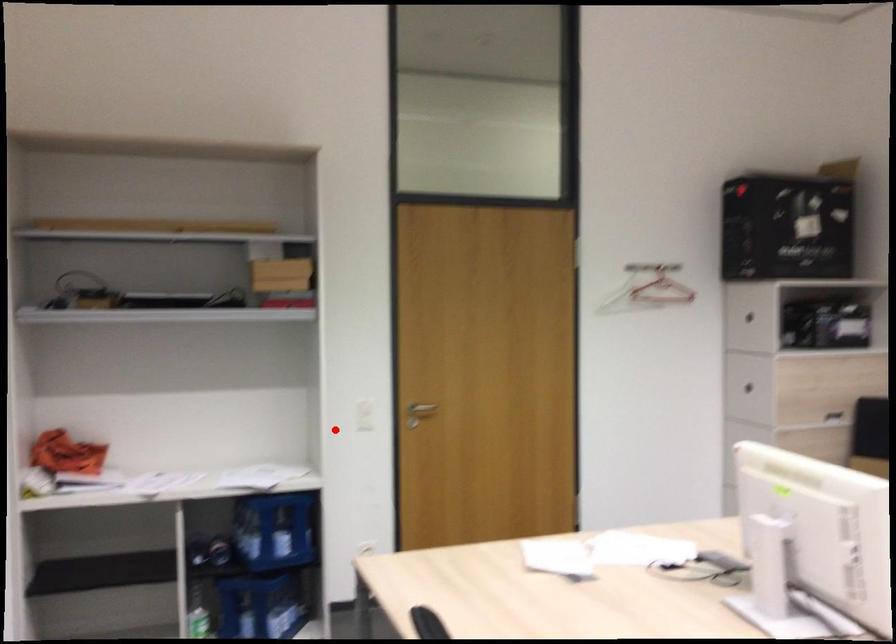
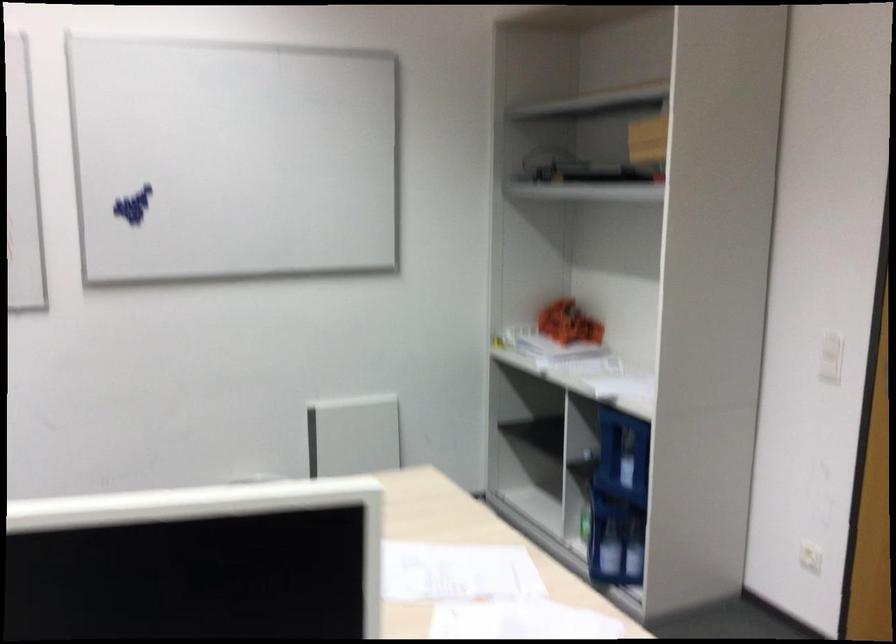
Question: A red point is marked in image1. In image2, is the corresponding 3D point closer to the camera or farther? Reply with the corresponding letter.

Choices:
 (A) The corresponding 3D point is closer.
 (B) The corresponding 3D point is farther.

Answer: (A)